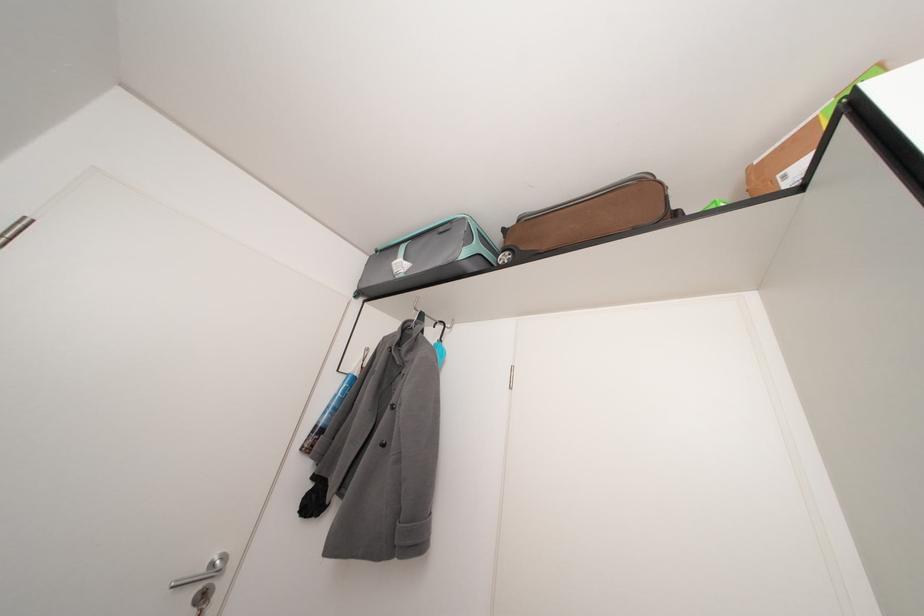
Find where to pull the brown wheeled bag. Please return your answer as a coordinate pair (x, y).

(589, 217)